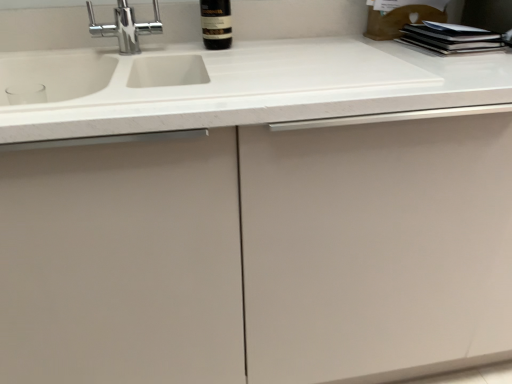
Locate an element on the screen. The image size is (512, 384). vacant area that is situated to the right of dark glass bottle at upper center is located at coordinates (289, 43).